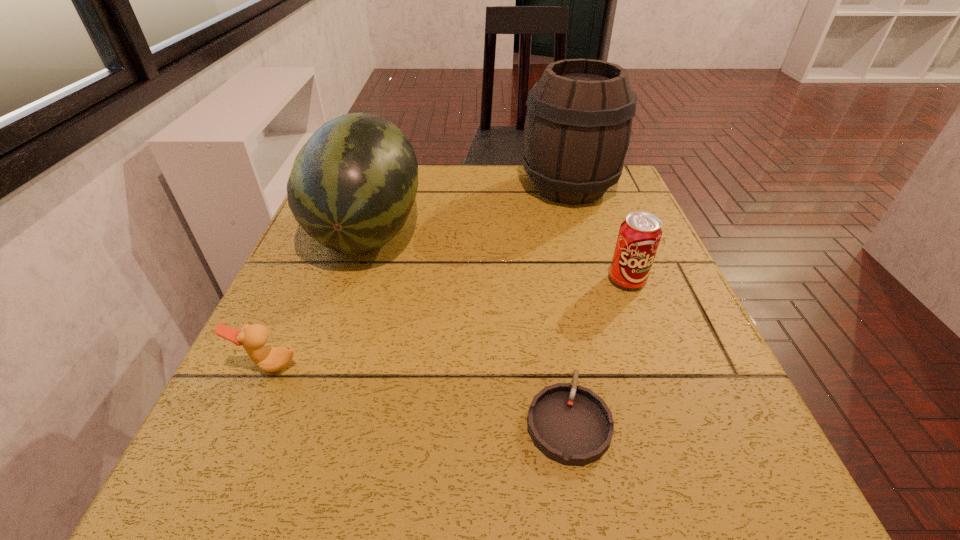
This screenshot has width=960, height=540. In order to click on vacant region that satisfies the following two spatial constraints: 1. on the back side of the ashtray; 2. on the right side of the wine bucket in this screenshot , I will do `click(529, 187)`.

Identify the location of free space that satisfies the following two spatial constraints: 1. on the front side of the wine bucket; 2. on the left side of the third tallest object. click(597, 280).

The image size is (960, 540). Identify the location of free location that satisfies the following two spatial constraints: 1. on the front side of the second tallest object; 2. on the left side of the shortest object. (303, 420).